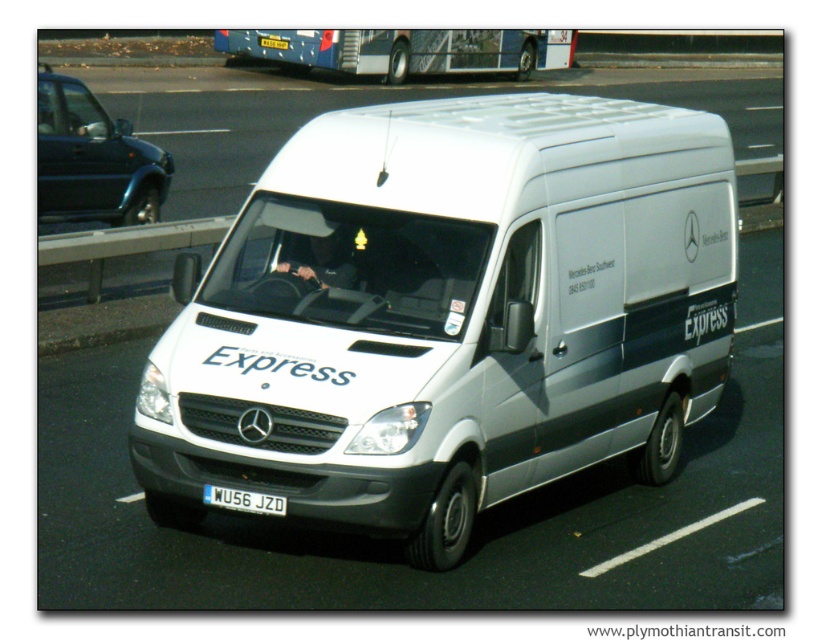
Question: Which of the following is the closest to the observer?

Choices:
 (A) white glossy van at center
 (B) metallic blue sedan at left
 (C) blue metallic bus at upper center

Answer: (B)

Question: Estimate the real-world distances between objects in this image. Which object is farther from the white metallic license plate at center?

Choices:
 (A) white matte van at center
 (B) white glossy van at center

Answer: (B)

Question: Among these objects, which one is farthest from the camera?

Choices:
 (A) white metallic license plate at center
 (B) white glossy van at center
 (C) white matte van at center

Answer: (B)

Question: Is white matte van at center positioned before blue metallic bus at upper center?

Choices:
 (A) no
 (B) yes

Answer: (B)

Question: Does white glossy van at center lie behind white metallic license plate at center?

Choices:
 (A) yes
 (B) no

Answer: (A)

Question: Can you confirm if white glossy van at center is smaller than white metallic license plate at center?

Choices:
 (A) yes
 (B) no

Answer: (B)